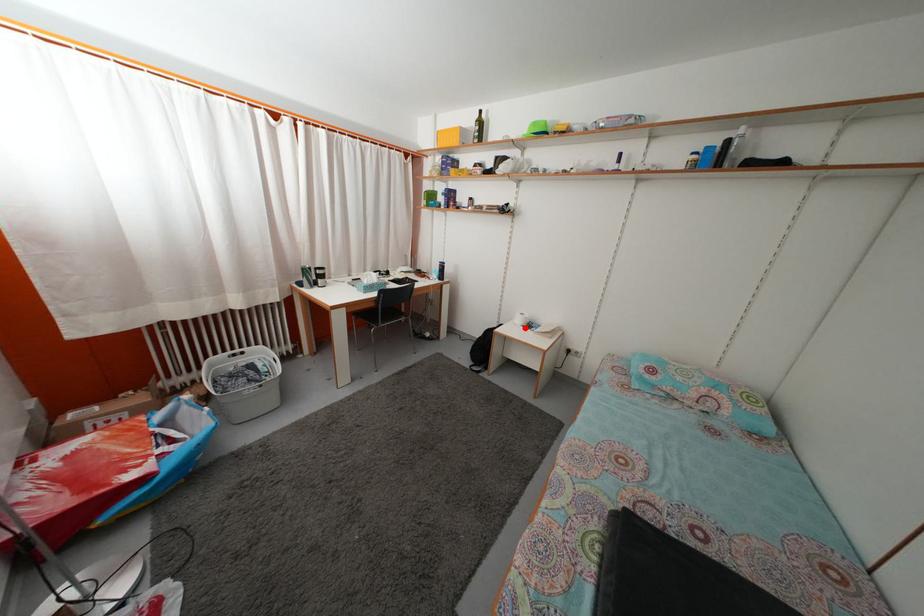
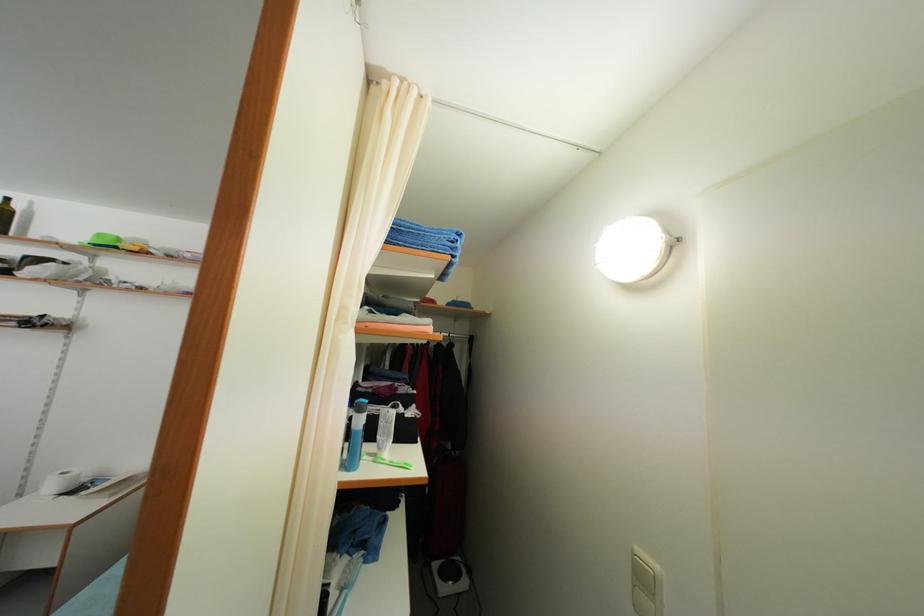
Locate, in the second image, the point that corresponds to the highlighted location in the first image.

(56, 493)